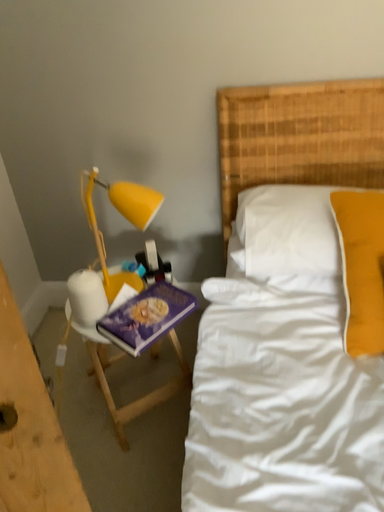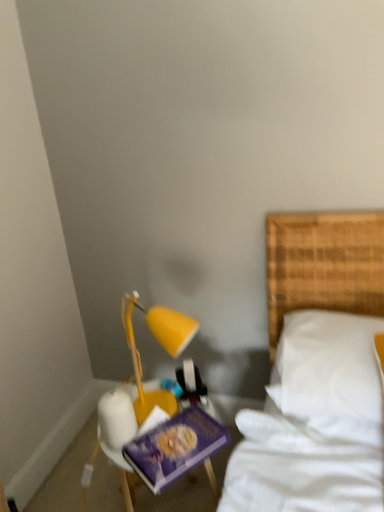
Question: Which way did the camera rotate in the video?

Choices:
 (A) rotated upward
 (B) rotated downward

Answer: (A)